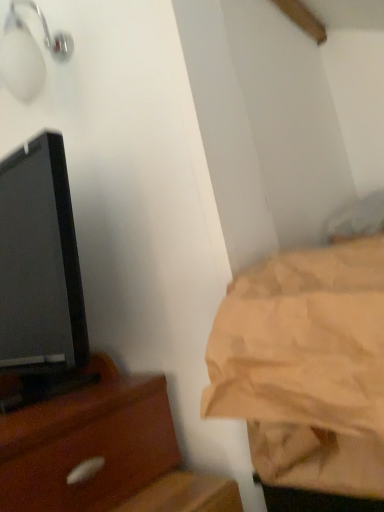
In order to face white glossy light fixture at upper left, should I rotate leftwards or rightwards?

Rotate left and turn 22.059 degrees.

What is the approximate width of white glossy light fixture at upper left?

7.79 inches.

Measure the distance between beige fabric bedsheet at right and camera.

The distance of beige fabric bedsheet at right from camera is 35.80 centimeters.

Where is `white glossy light fixture at upper left`? white glossy light fixture at upper left is located at coordinates (28, 53).

Which object is wider, white glossy light fixture at upper left or beige fabric bedsheet at right?

beige fabric bedsheet at right.

Does white glossy light fixture at upper left lie behind beige fabric bedsheet at right?

That is True.

Based on the photo, is white glossy light fixture at upper left not close to beige fabric bedsheet at right?

No, white glossy light fixture at upper left is not far away from beige fabric bedsheet at right.

Considering the sizes of objects white glossy light fixture at upper left and beige fabric bedsheet at right in the image provided, who is smaller, white glossy light fixture at upper left or beige fabric bedsheet at right?

Smaller between the two is white glossy light fixture at upper left.

Is white glossy light fixture at upper left in contact with black glossy tv at left?

white glossy light fixture at upper left and black glossy tv at left are clearly separated.

Considering the relative sizes of white glossy light fixture at upper left and black glossy tv at left in the image provided, is white glossy light fixture at upper left shorter than black glossy tv at left?

Yes, white glossy light fixture at upper left is shorter than black glossy tv at left.

How far apart are white glossy light fixture at upper left and black glossy tv at left?

white glossy light fixture at upper left is 12.95 inches from black glossy tv at left.

Considering the relative positions of white glossy light fixture at upper left and black glossy tv at left in the image provided, is white glossy light fixture at upper left in front of black glossy tv at left?

No, white glossy light fixture at upper left is further to the viewer.

Is black glossy tv at left in front of or behind beige fabric bedsheet at right in the image?

Visually, black glossy tv at left is located behind beige fabric bedsheet at right.

Which of these two, black glossy tv at left or beige fabric bedsheet at right, is thinner?

beige fabric bedsheet at right.

Could you tell me if black glossy tv at left is turned towards beige fabric bedsheet at right?

Yes, black glossy tv at left is facing beige fabric bedsheet at right.

Is point (65, 180) positioned behind point (250, 349)?

Yes.

Relative to white glossy light fixture at upper left, is beige fabric bedsheet at right in front or behind?

In the image, beige fabric bedsheet at right appears in front of white glossy light fixture at upper left.

Is beige fabric bedsheet at right turned away from white glossy light fixture at upper left?

That's not correct — beige fabric bedsheet at right is not looking away from white glossy light fixture at upper left.

Image resolution: width=384 pixels, height=512 pixels. In order to click on light fixture behind the beige fabric bedsheet at right in this screenshot , I will do `click(28, 53)`.

Considering the relative sizes of beige fabric bedsheet at right and black glossy tv at left in the image provided, is beige fabric bedsheet at right thinner than black glossy tv at left?

Correct, the width of beige fabric bedsheet at right is less than that of black glossy tv at left.

Looking at the image, does beige fabric bedsheet at right seem bigger or smaller compared to black glossy tv at left?

Clearly, beige fabric bedsheet at right is smaller in size than black glossy tv at left.

Which object is positioned more to the right, beige fabric bedsheet at right or black glossy tv at left?

beige fabric bedsheet at right is more to the right.

Considering the positions of points (35, 369) and (18, 90), is point (35, 369) farther from camera compared to point (18, 90)?

No, (35, 369) is in front of (18, 90).

Where is `tv show in front of the white glossy light fixture at upper left`? The height and width of the screenshot is (512, 384). tv show in front of the white glossy light fixture at upper left is located at coordinates (39, 268).

Is black glossy tv at left in front of or behind white glossy light fixture at upper left in the image?

Clearly, black glossy tv at left is in front of white glossy light fixture at upper left.

Find the location of a particular element. light fixture on the left of the beige fabric bedsheet at right is located at coordinates (28, 53).

You are a GUI agent. You are given a task and a screenshot of the screen. Output one action in this format:
    pyautogui.click(x=<x>, y=<y>)
    Task: Click on the light fixture that is on the right side of black glossy tv at left
    
    Given the screenshot: What is the action you would take?
    pyautogui.click(x=28, y=53)

Which object lies further to the anchor point black glossy tv at left, beige fabric bedsheet at right or white glossy light fixture at upper left?

Based on the image, beige fabric bedsheet at right appears to be further to black glossy tv at left.

From the image, which object appears to be farther from white glossy light fixture at upper left, beige fabric bedsheet at right or black glossy tv at left?

beige fabric bedsheet at right is further to white glossy light fixture at upper left.

Looking at the image, which one is located further to beige fabric bedsheet at right, black glossy tv at left or white glossy light fixture at upper left?

white glossy light fixture at upper left is further to beige fabric bedsheet at right.

Considering their positions, is white glossy light fixture at upper left positioned further to beige fabric bedsheet at right than black glossy tv at left?

white glossy light fixture at upper left.

When comparing their distances from black glossy tv at left, does white glossy light fixture at upper left or beige fabric bedsheet at right seem further?

beige fabric bedsheet at right is positioned further to the anchor black glossy tv at left.

Looking at the image, which one is located further to white glossy light fixture at upper left, black glossy tv at left or beige fabric bedsheet at right?

beige fabric bedsheet at right is further to white glossy light fixture at upper left.

Locate an element on the screen. tv show that lies between white glossy light fixture at upper left and beige fabric bedsheet at right from top to bottom is located at coordinates (39, 268).